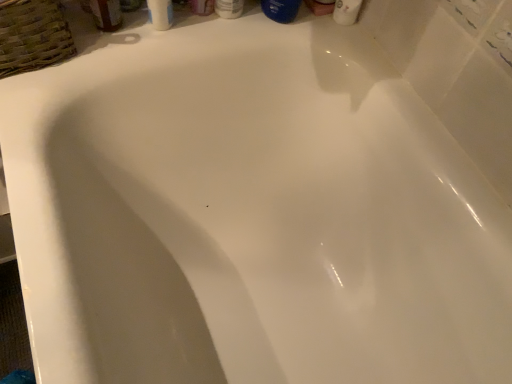
Identify the location of free space in front of white glossy bottle at upper center, the second toiletry from the left. This screenshot has height=384, width=512. (195, 35).